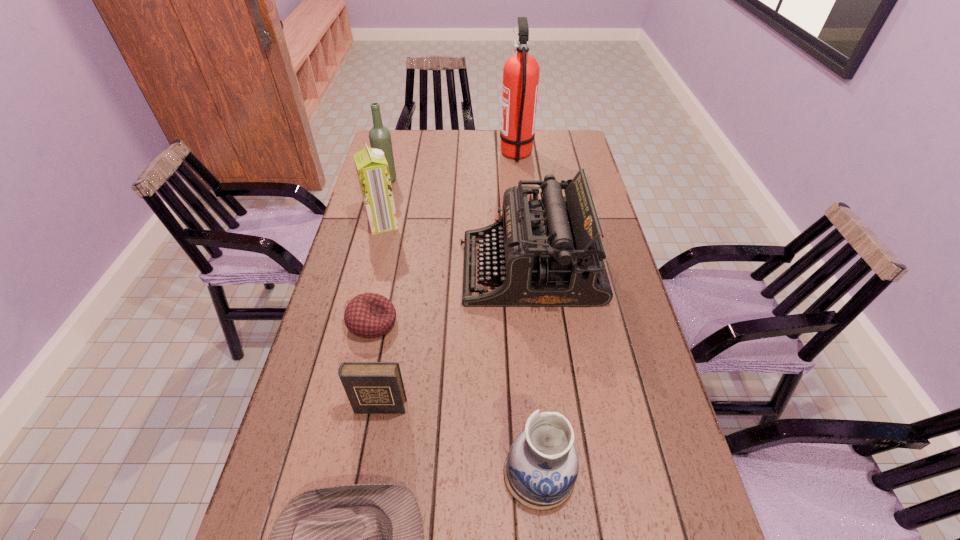
You are a GUI agent. You are given a task and a screenshot of the screen. Output one action in this format:
    pyautogui.click(x=<x>, y=<y>)
    Task: Click on the farthest object
    Image resolution: width=960 pixels, height=540 pixels.
    Given the screenshot: What is the action you would take?
    pyautogui.click(x=521, y=72)

This screenshot has width=960, height=540. Find the location of `fire extinguisher`. fire extinguisher is located at coordinates (521, 72).

Find the location of a particular element. wine bottle is located at coordinates (380, 138).

Find the location of a particular element. soya milk is located at coordinates (372, 169).

Find the location of a particular element. Image resolution: width=960 pixels, height=540 pixels. typewriter is located at coordinates (547, 252).

Identify the location of the fifth tallest object. This screenshot has height=540, width=960. tap(540, 471).

I want to click on the third nearest object, so click(371, 387).

The width and height of the screenshot is (960, 540). I want to click on diary, so click(371, 387).

Identify the location of the shortest object. (369, 315).

Locate an element on the screen. The height and width of the screenshot is (540, 960). free spot located on the handle side of the tallest object is located at coordinates (437, 154).